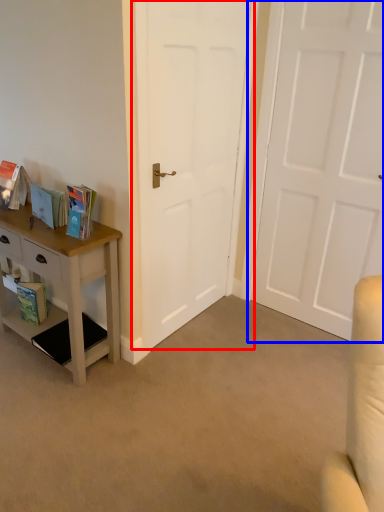
Question: Which of the following is the farthest to the observer, door (highlighted by a red box) or door (highlighted by a blue box)?

Choices:
 (A) door
 (B) door

Answer: (B)